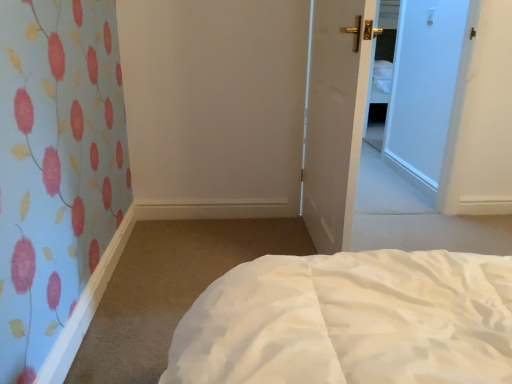
Question: Visually, is white soft bed at lower center positioned to the left or to the right of white matte door at center?

Choices:
 (A) left
 (B) right

Answer: (B)

Question: From a real-world perspective, is white soft bed at lower center positioned above or below white matte door at center?

Choices:
 (A) below
 (B) above

Answer: (A)

Question: In terms of height, does white soft bed at lower center look taller or shorter compared to white matte door at center?

Choices:
 (A) tall
 (B) short

Answer: (B)

Question: Based on their sizes in the image, would you say white matte door at center is bigger or smaller than white soft bed at lower center?

Choices:
 (A) big
 (B) small

Answer: (A)

Question: Considering the positions of white matte door at center and white soft bed at lower center in the image, is white matte door at center wider or thinner than white soft bed at lower center?

Choices:
 (A) wide
 (B) thin

Answer: (B)

Question: Which is correct: white matte door at center is inside white soft bed at lower center, or outside of it?

Choices:
 (A) inside
 (B) outside

Answer: (B)

Question: Is point (309, 142) closer or farther from the camera than point (388, 253)?

Choices:
 (A) farther
 (B) closer

Answer: (A)